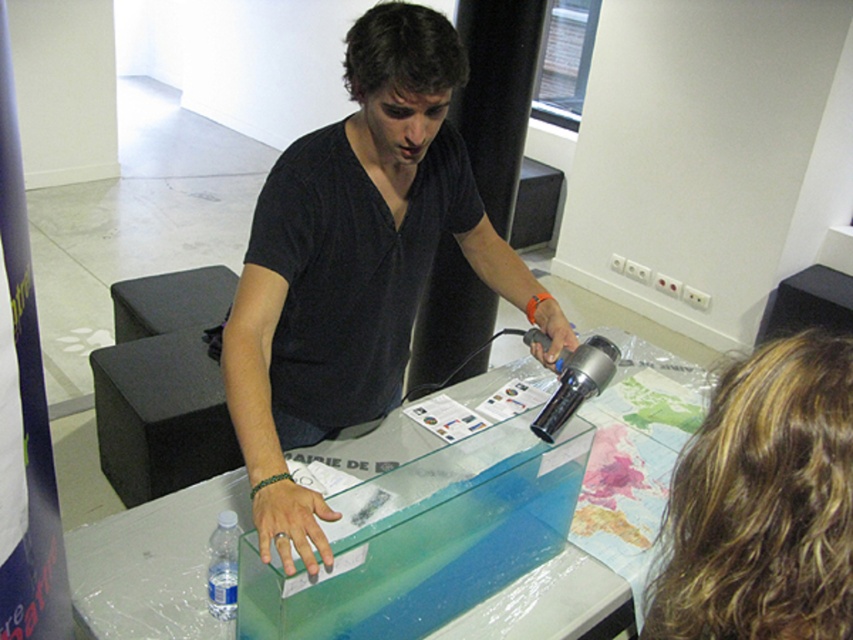
Question: Which of the following is the closest to the observer?

Choices:
 (A) (223, 586)
 (B) (561, 451)
 (C) (259, 328)

Answer: (A)

Question: Is the position of transparent glass table at center less distant than that of black matte shirt at center?

Choices:
 (A) no
 (B) yes

Answer: (A)

Question: Can you confirm if black matte shirt at center is smaller than transparent plastic bottle at lower left?

Choices:
 (A) yes
 (B) no

Answer: (B)

Question: Is transparent glass table at center above black matte shirt at center?

Choices:
 (A) no
 (B) yes

Answer: (A)

Question: Which of the following is the closest to the observer?

Choices:
 (A) transparent glass table at center
 (B) transparent plastic bottle at lower left

Answer: (A)

Question: Considering the real-world distances, which object is closest to the transparent glass table at center?

Choices:
 (A) transparent plastic bottle at lower left
 (B) black matte shirt at center

Answer: (B)